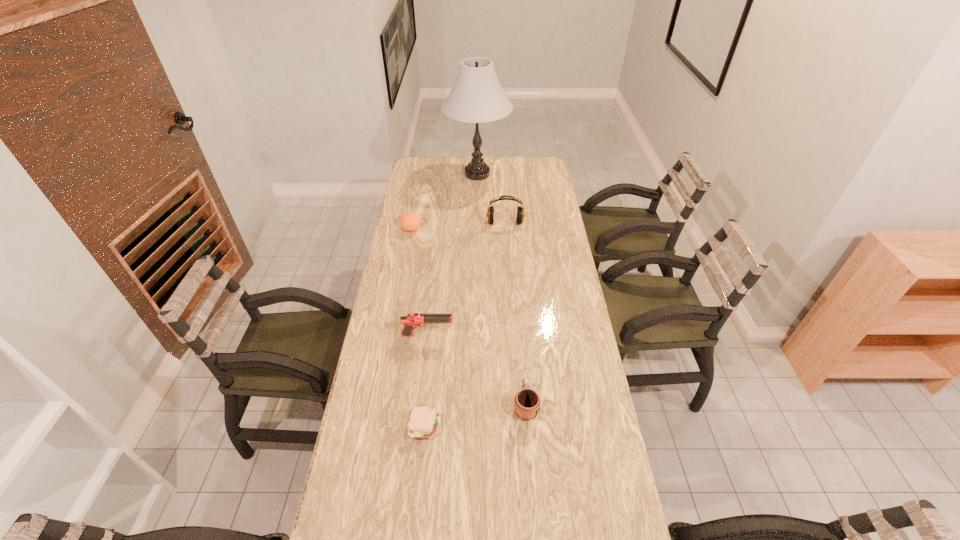
The width and height of the screenshot is (960, 540). Identify the location of vacant area situated 0.140m at the aiming end of the fourth shortest object. (492, 335).

Find the location of a particular element. The height and width of the screenshot is (540, 960). free spot located 0.380m on the front of the orange is located at coordinates (399, 296).

At what (x,y) coordinates should I click in order to perform the action: click on free location located 0.290m on the side of the fifth tallest object with the handle. Please return your answer as a coordinate pair (x, y). The width and height of the screenshot is (960, 540). Looking at the image, I should click on (518, 320).

Where is `vacant space situated on the side of the fifth tallest object with the handle`? The image size is (960, 540). vacant space situated on the side of the fifth tallest object with the handle is located at coordinates (519, 334).

Identify the location of vacant space located 0.300m on the side of the fifth tallest object with the handle. (518, 318).

The width and height of the screenshot is (960, 540). In order to click on free region located 0.400m on the right of the shortest object in this screenshot , I will do [573, 427].

At what (x,y) coordinates should I click in order to perform the action: click on object that is at the far edge. Please return your answer as a coordinate pair (x, y). The height and width of the screenshot is (540, 960). Looking at the image, I should click on (476, 97).

Image resolution: width=960 pixels, height=540 pixels. What are the coordinates of `gun located at the left edge` in the screenshot? It's located at click(x=412, y=320).

This screenshot has width=960, height=540. Identify the location of orange that is positioned at the left edge. (410, 221).

Where is `vacant position at the far edge of the desktop`? Image resolution: width=960 pixels, height=540 pixels. vacant position at the far edge of the desktop is located at coordinates (444, 177).